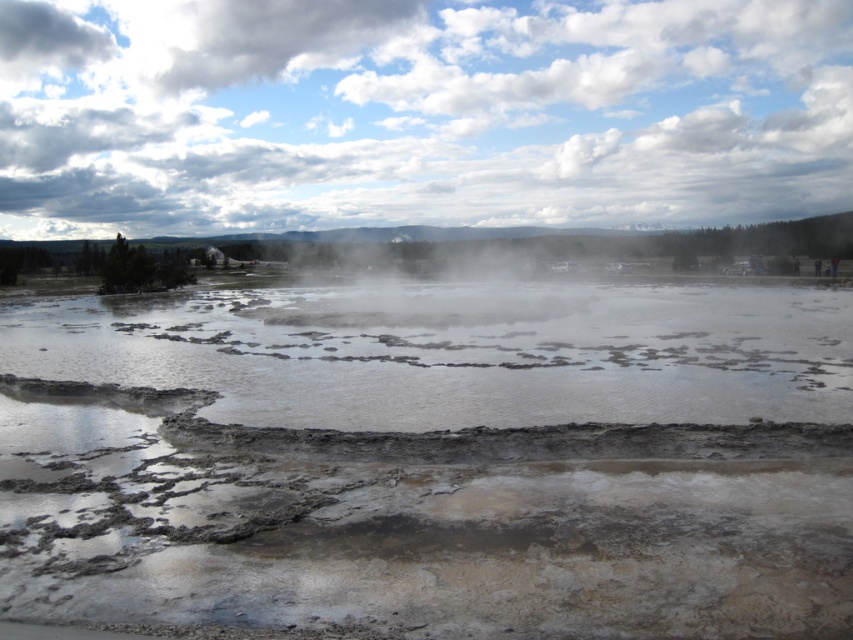
You are a park ranger assessing the safety of the geothermal area. You notice the muddy water at center and the white misty steam at center. Which object is situated closer to your current position?

The muddy water at center is closer to the viewer than the white misty steam at center.

You are a park ranger standing at the edge of the geothermal area. You need to check the temperature of the muddy water at center. Can you safely reach it with a 5 meter long thermometer probe?

The muddy water at center is 5.45 meters away from the camera. Since the thermometer probe is only 5 meters long, it cannot reach the muddy water at center. You need a longer probe or a different method to measure the temperature.